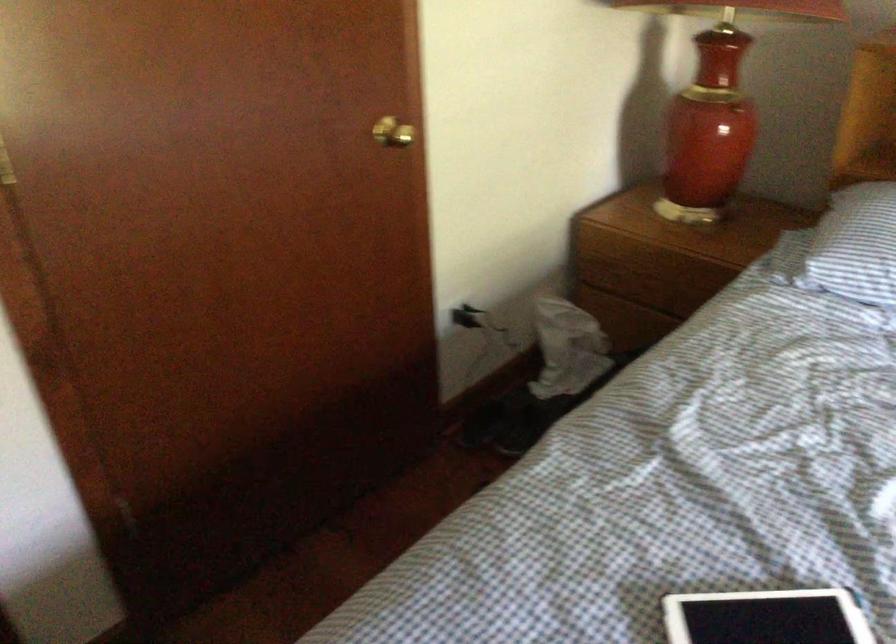
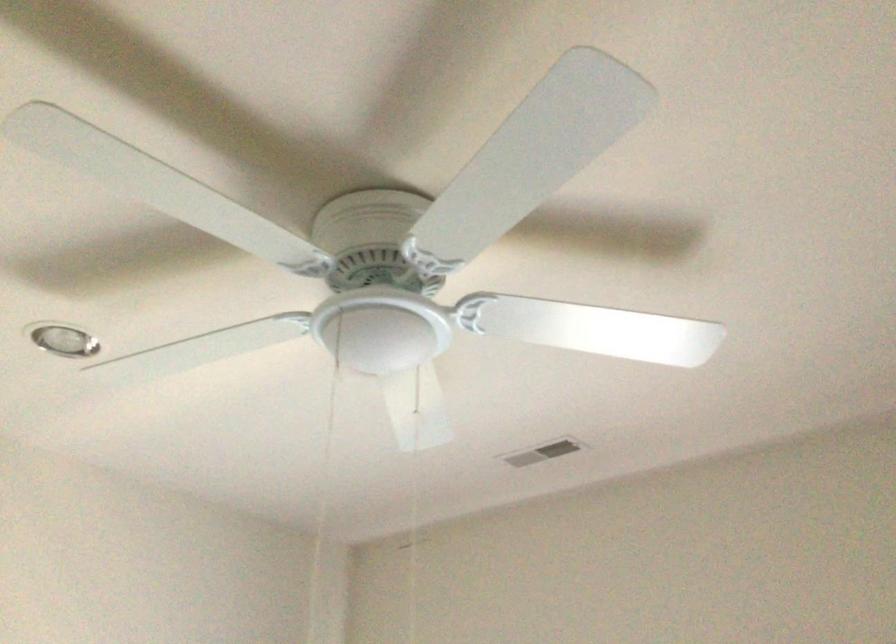
In the scene shown: How did the camera likely rotate?

The camera rotated toward right-up.